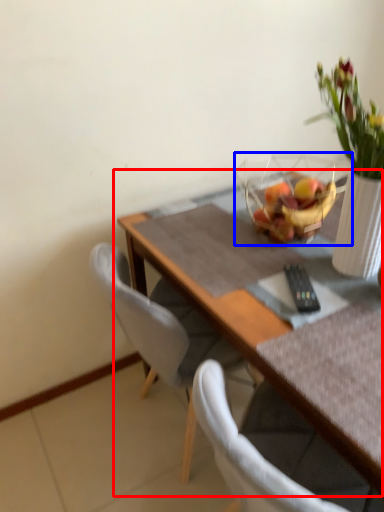
Question: Which point is closer to the camera, table (highlighted by a red box) or basket (highlighted by a blue box)?

Choices:
 (A) table
 (B) basket

Answer: (A)